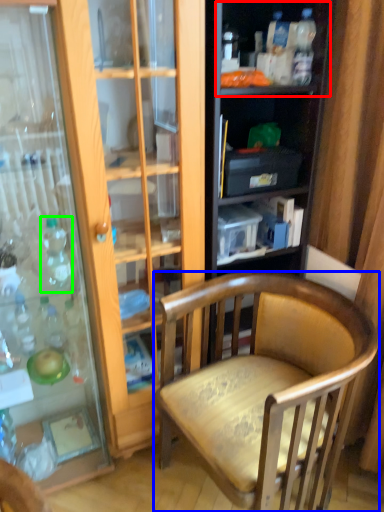
Question: Estimate the real-world distances between objects in this image. Which object is closer to shelf (highlighted by a red box), chair (highlighted by a blue box) or bottle (highlighted by a green box)?

Choices:
 (A) chair
 (B) bottle

Answer: (A)